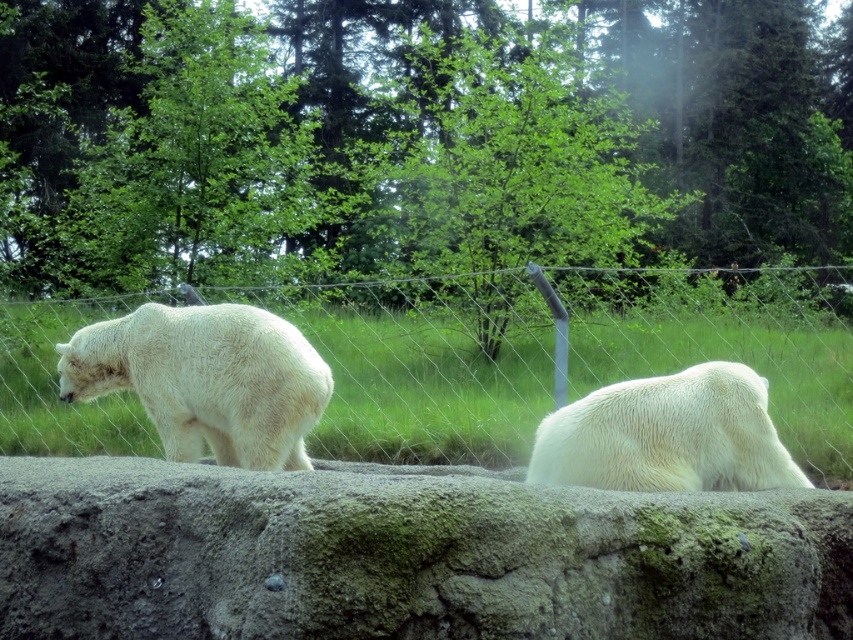
Between wire mesh fence at center and white fluffy bear at left, which one appears on the left side from the viewer's perspective?

white fluffy bear at left is more to the left.

In the scene shown: Does wire mesh fence at center appear over white fluffy bear at left?

Yes.

Which is behind, point (778, 276) or point (186, 442)?

Point (778, 276)

Image resolution: width=853 pixels, height=640 pixels. Find the location of `wire mesh fence at center`. wire mesh fence at center is located at coordinates (561, 353).

Can you confirm if mossy concrete boulder at center is positioned to the left of wire mesh fence at center?

Correct, you'll find mossy concrete boulder at center to the left of wire mesh fence at center.

Which of these two, mossy concrete boulder at center or wire mesh fence at center, stands taller?

wire mesh fence at center is taller.

Where is `mossy concrete boulder at center`? mossy concrete boulder at center is located at coordinates (405, 556).

Locate an element on the screen. The width and height of the screenshot is (853, 640). mossy concrete boulder at center is located at coordinates (405, 556).

Image resolution: width=853 pixels, height=640 pixels. Describe the element at coordinates (206, 380) in the screenshot. I see `white fluffy bear at left` at that location.

Who is more distant from viewer, (300, 410) or (712, 371)?

Point (300, 410)

Find the location of a particular element. Image resolution: width=853 pixels, height=640 pixels. white fluffy bear at left is located at coordinates (206, 380).